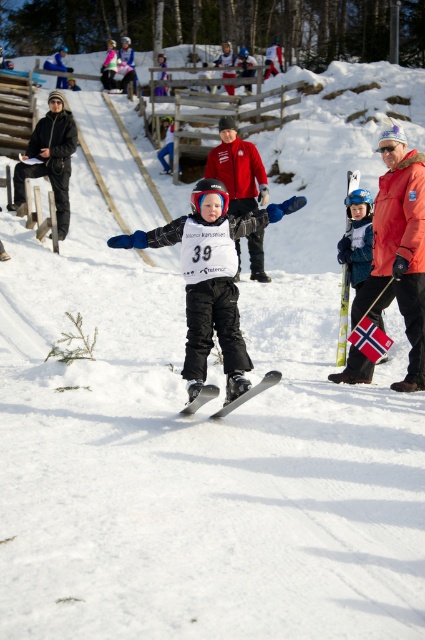
You are a ski equipment inspector checking the width of the matte black snowboard at center and the matte black skis at center. According to the safety regulations, the snowboard must not be wider than the skis. Can you confirm if the snowboard meets the width requirement?

The matte black snowboard at center might be wider than matte black skis at center, so it may not meet the safety requirement. Further measurement is needed to confirm.

You are standing at the point with coordinates point (187,216) and want to see the child in the foreground. Is the child blocking your view of the point at point (212,396)?

Point (187,216) is behind point (212,396), so the child in the foreground would block the view of point (212,396) from point (187,216).

You are organizing a storage area for winter sports equipment. You have a matte black snowboard at center and a yellow metallic ski at right. Which item requires more storage space?

The yellow metallic ski at right requires more storage space because it occupies more space than the matte black snowboard at center.